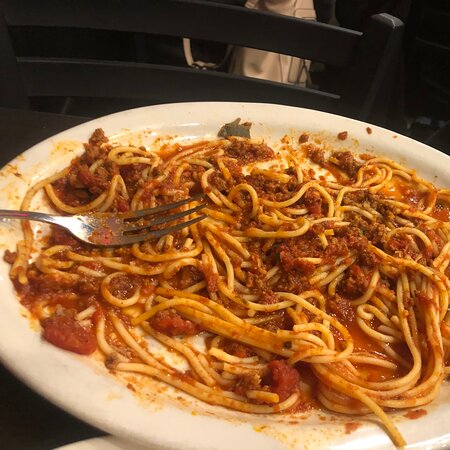
Where is `white plate`? This screenshot has width=450, height=450. white plate is located at coordinates (217, 437).